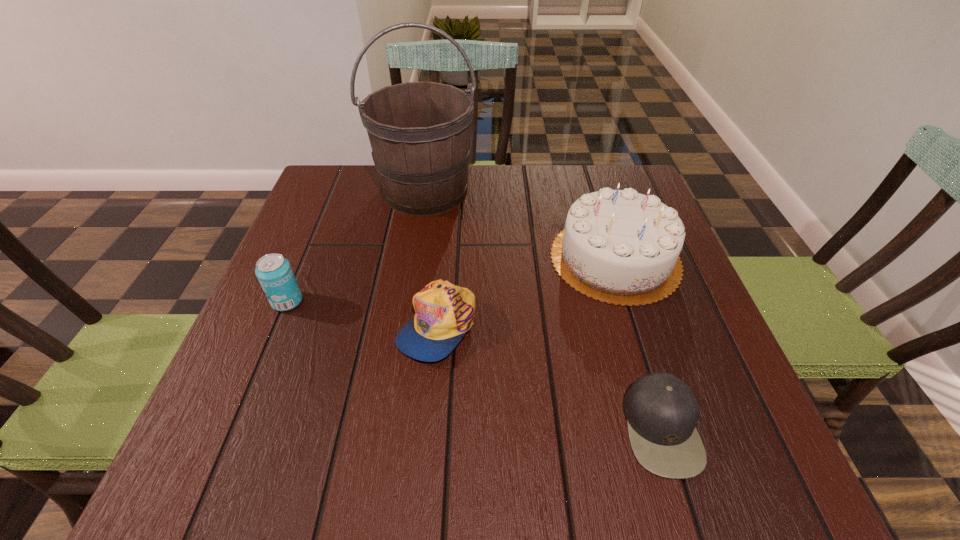
This screenshot has height=540, width=960. Identify the location of free space located 0.130m on the bill of the left cap. (426, 437).

Locate an element on the screen. vacant space positioned on the brim of the nearer cap is located at coordinates (539, 428).

Identify the location of vacant space located on the brim of the nearer cap. The height and width of the screenshot is (540, 960). (440, 428).

The height and width of the screenshot is (540, 960). Identify the location of vacant space located on the brim of the nearer cap. (415, 428).

I want to click on object situated at the far edge, so click(x=419, y=132).

Where is `object positioned at the near edge`? This screenshot has height=540, width=960. object positioned at the near edge is located at coordinates pyautogui.click(x=662, y=411).

Where is `bucket positioned at the left edge`? This screenshot has width=960, height=540. bucket positioned at the left edge is located at coordinates (419, 132).

This screenshot has height=540, width=960. In order to click on beer can present at the left edge in this screenshot , I will do `click(274, 272)`.

What are the coordinates of `birthday cake located in the right edge section of the desktop` in the screenshot? It's located at (618, 246).

Where is `cap that is at the right edge`? cap that is at the right edge is located at coordinates (662, 411).